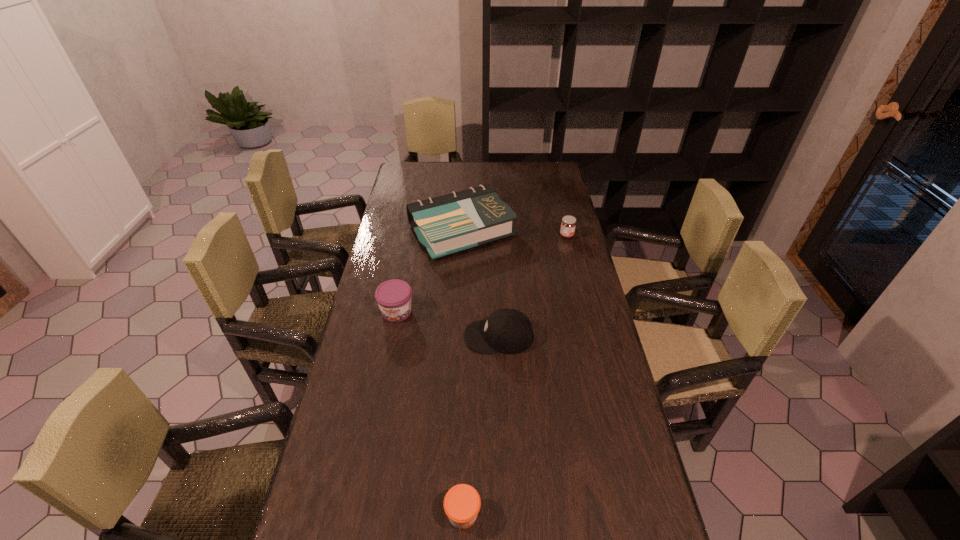
Where is `free space located on the front-facing side of the cap`? Image resolution: width=960 pixels, height=540 pixels. free space located on the front-facing side of the cap is located at coordinates (397, 336).

Locate an element on the screen. free spot located 0.280m on the front-facing side of the cap is located at coordinates (375, 336).

The image size is (960, 540). Identify the location of vacant space located on the front label of the second farthest jam. (382, 387).

Where is `vacant area situated on the front of the farthest jam`? vacant area situated on the front of the farthest jam is located at coordinates click(x=574, y=265).

At what (x,y) coordinates should I click in order to perform the action: click on vacant space located 0.160m on the front label of the second jam from left to right. Please return your answer as a coordinate pair (x, y). Image resolution: width=960 pixels, height=540 pixels. Looking at the image, I should click on (552, 514).

This screenshot has height=540, width=960. Identify the location of paperback book situated at the left edge. (450, 223).

In order to click on jam present at the left edge in this screenshot , I will do `click(394, 296)`.

You are a GUI agent. You are given a task and a screenshot of the screen. Output one action in this format:
    pyautogui.click(x=<x>, y=<y>)
    Task: Click on the object at the right edge
    The height and width of the screenshot is (540, 960).
    Given the screenshot: What is the action you would take?
    pyautogui.click(x=568, y=223)

This screenshot has width=960, height=540. I want to click on vacant region at the far edge of the desktop, so click(521, 173).

This screenshot has width=960, height=540. In the image, there is a desktop. Identify the location of free region at the left edge. (400, 195).